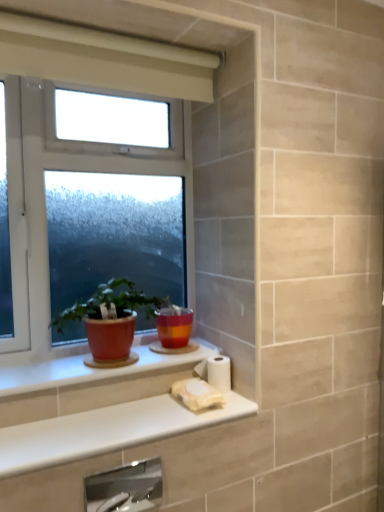
Locate an element on the screen. The width and height of the screenshot is (384, 512). empty space that is ontop of white glossy counter top at lower center (from a real-world perspective) is located at coordinates (122, 418).